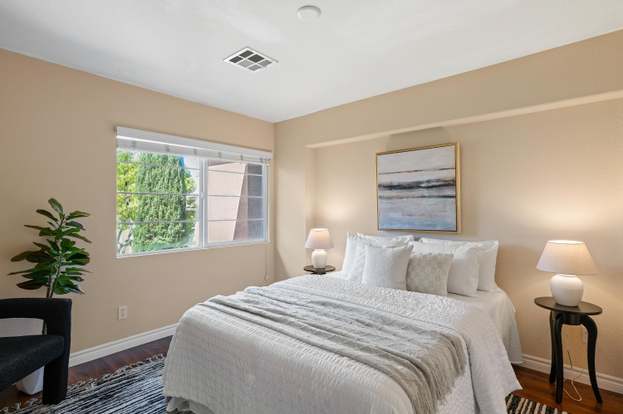
Locate an element on the screen. Image resolution: width=623 pixels, height=414 pixels. air vent opening slats is located at coordinates (235, 58), (243, 62), (254, 66), (267, 61), (258, 56), (245, 52).